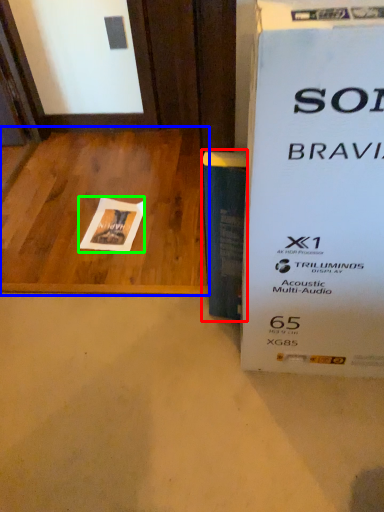
Question: Which is nearer to the paperback book (highlighted by a red box)? table (highlighted by a blue box) or flyer (highlighted by a green box).

Choices:
 (A) table
 (B) flyer

Answer: (B)